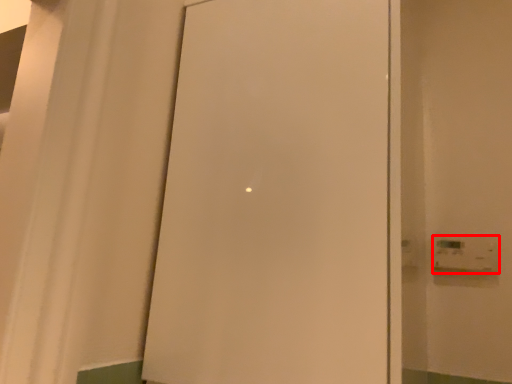
Question: Where is light switch (annotated by the red box) located in relation to door in the image?

Choices:
 (A) left
 (B) right

Answer: (B)